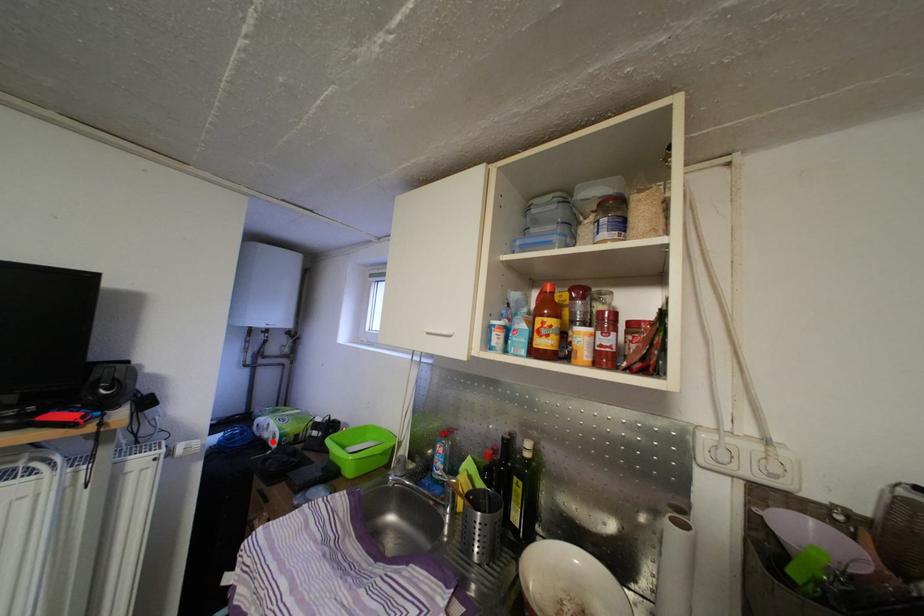
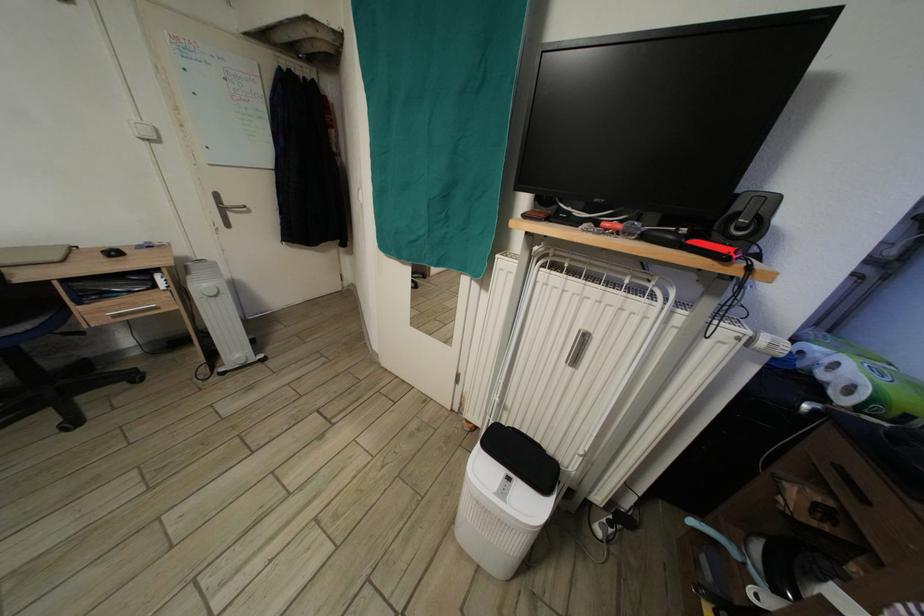
Locate, in the second image, the point that corresponds to the highlighted location in the first image.

(830, 383)